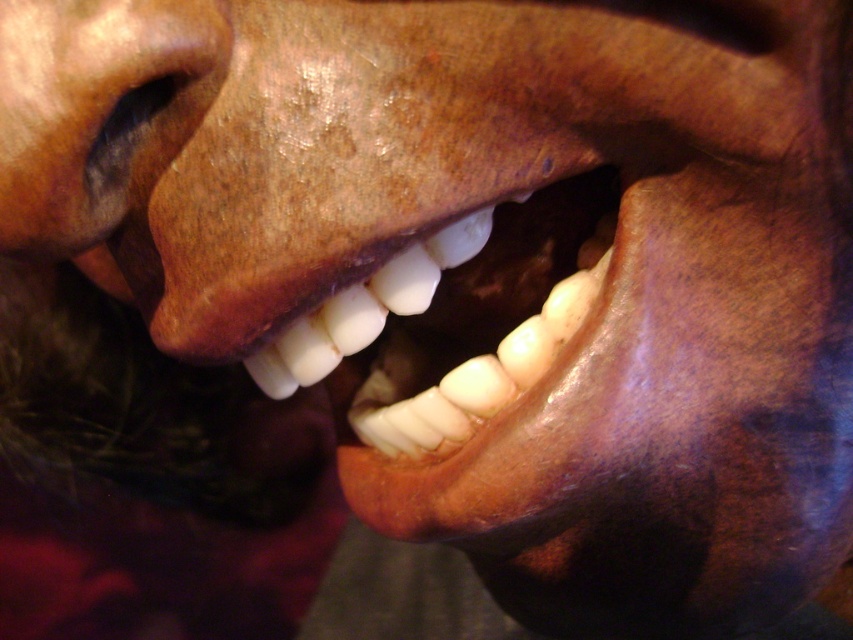
Question: Which point is farther to the camera?

Choices:
 (A) (387, 378)
 (B) (83, 163)

Answer: (A)

Question: Among these points, which one is nearest to the camera?

Choices:
 (A) (48, 112)
 (B) (567, 234)

Answer: (A)

Question: Is the position of white glossy teeth at center less distant than that of matte brown nose at center?

Choices:
 (A) no
 (B) yes

Answer: (A)

Question: Is the position of white glossy teeth at center more distant than that of matte brown nose at center?

Choices:
 (A) yes
 (B) no

Answer: (A)

Question: Which point is farther from the camera taking this photo?

Choices:
 (A) (76, 99)
 (B) (601, 202)

Answer: (B)

Question: Does white glossy teeth at center have a larger size compared to matte brown nose at center?

Choices:
 (A) no
 (B) yes

Answer: (B)